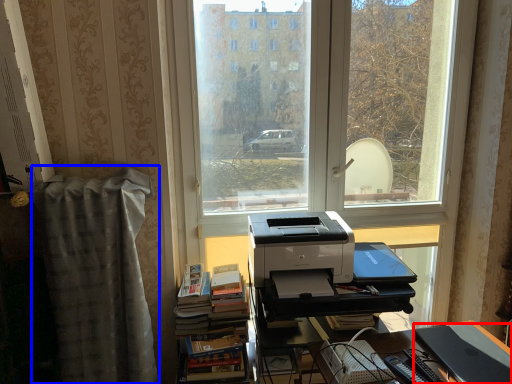
Question: Which point is further to the camera, register (highlighted by a red box) or curtain (highlighted by a blue box)?

Choices:
 (A) register
 (B) curtain

Answer: (B)